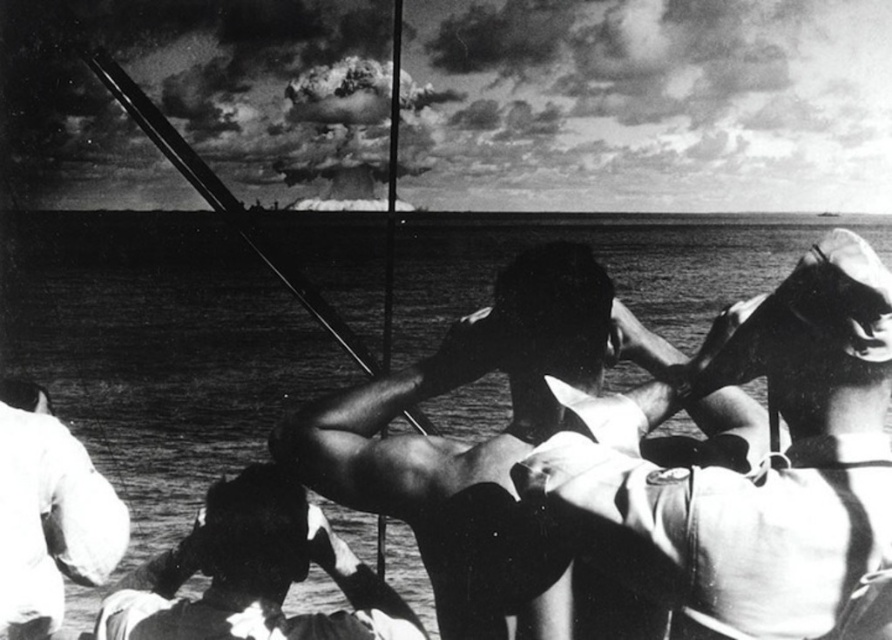
You are a photographer reviewing this historical maritime image. You notice two men at the center of the scene, described as smooth skin man at center and dark skin man at center. Based on their positions, which man appears to be standing taller in the image?

The smooth skin man at center is taller than the dark skin man at center, so the smooth skin man at center appears to be standing taller in the image.

You are a photographer analyzing this historical maritime scene. You notice the smooth skin man at center and the white matte uniform at lower left. Based on their positions, which object is closer to the front of the image?

The smooth skin man at center is positioned over the white matte uniform at lower left, meaning he is closer to the front of the image.

In the maritime scene, there are two notable elements visible to the observer. One is a smooth skin man at center and the other is a white matte uniform at lower left. Based on their positions, which one is positioned more to the right side of the image?

The smooth skin man at center is positioned more to the right side of the image compared to the white matte uniform at lower left, as he is located to the right of it.